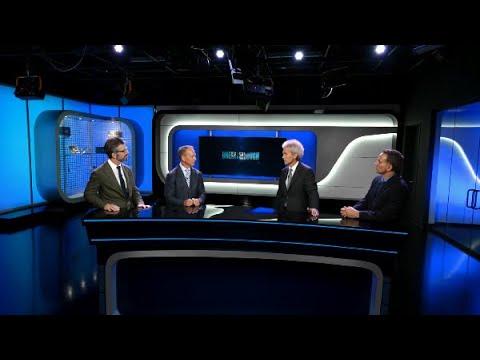
Find the location of a particular element. The width and height of the screenshot is (480, 360). big flat screen is located at coordinates (243, 165).